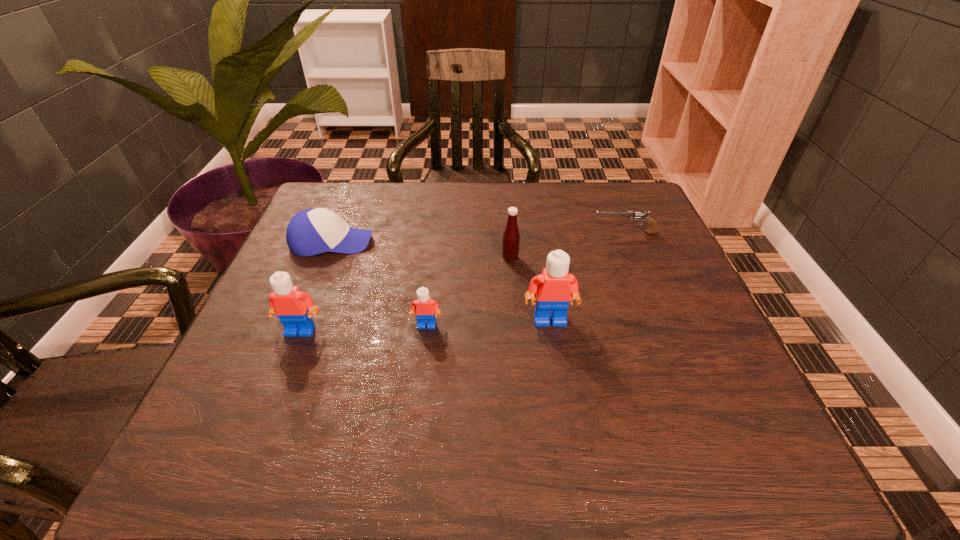
Please point out where to position a new Lego on the right to maintain spacing. Please provide its 2D coordinates. Your answer should be formatted as a tuple, i.e. [(x, y)], where the tuple contains the x and y coordinates of a point satisfying the conditions above.

[(670, 314)]